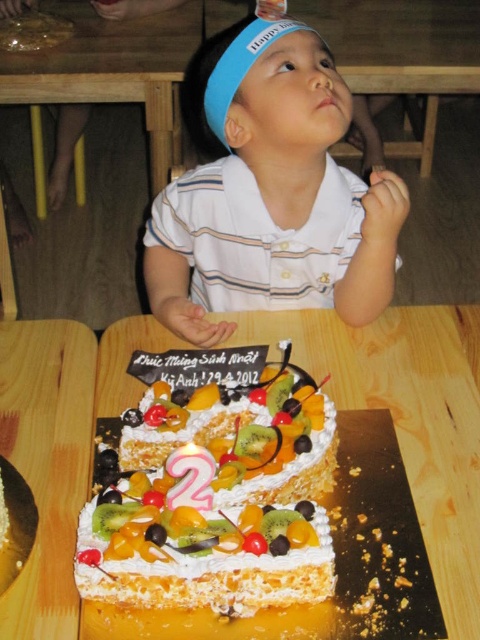
Question: Which of the following is the closest to the observer?

Choices:
 (A) whipped cream topped cake at center
 (B) wooden table at lower center
 (C) white striped shirt at center

Answer: (A)

Question: Which object appears farthest from the camera in this image?

Choices:
 (A) wooden table at lower center
 (B) white striped shirt at center
 (C) whipped cream topped cake at center

Answer: (B)

Question: Can you confirm if wooden table at lower center is wider than whipped cream topped cake at center?

Choices:
 (A) yes
 (B) no

Answer: (A)

Question: Which of the following is the closest to the observer?

Choices:
 (A) (80, 412)
 (B) (370, 300)

Answer: (A)

Question: Does wooden table at lower center have a larger size compared to white striped shirt at center?

Choices:
 (A) yes
 (B) no

Answer: (A)

Question: Is whipped cream topped cake at center positioned before white striped shirt at center?

Choices:
 (A) yes
 (B) no

Answer: (A)